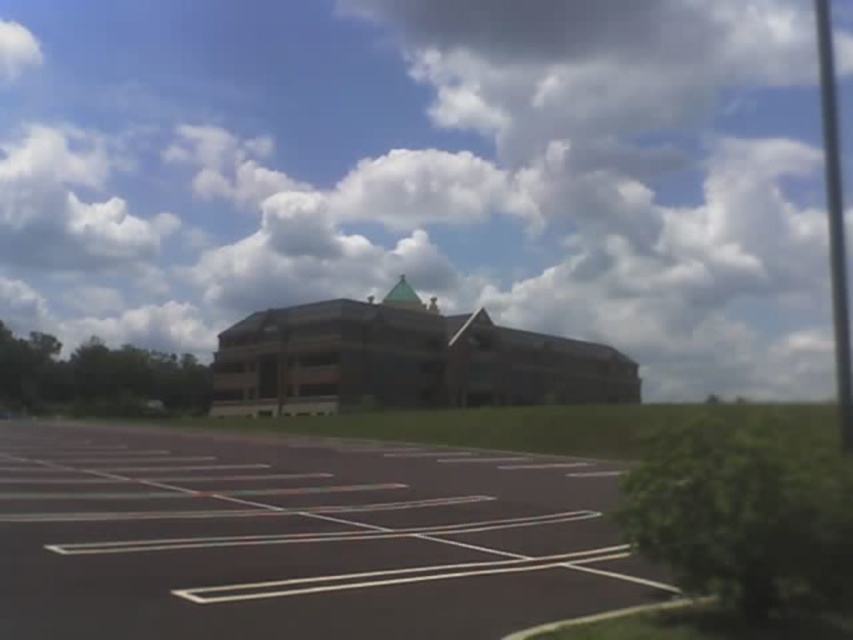
In the scene shown: Who is positioned more to the left, cloudy sky at upper center or black asphalt parking lot at center?

Positioned to the left is black asphalt parking lot at center.

Between point (669, 234) and point (109, 611), which one is positioned in front?

Point (109, 611)

Locate an element on the screen. cloudy sky at upper center is located at coordinates (425, 172).